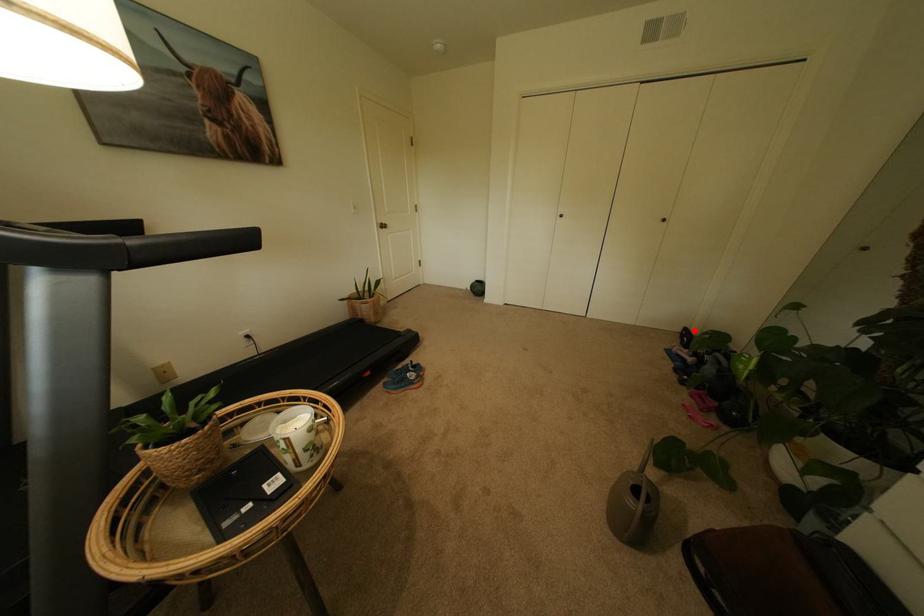
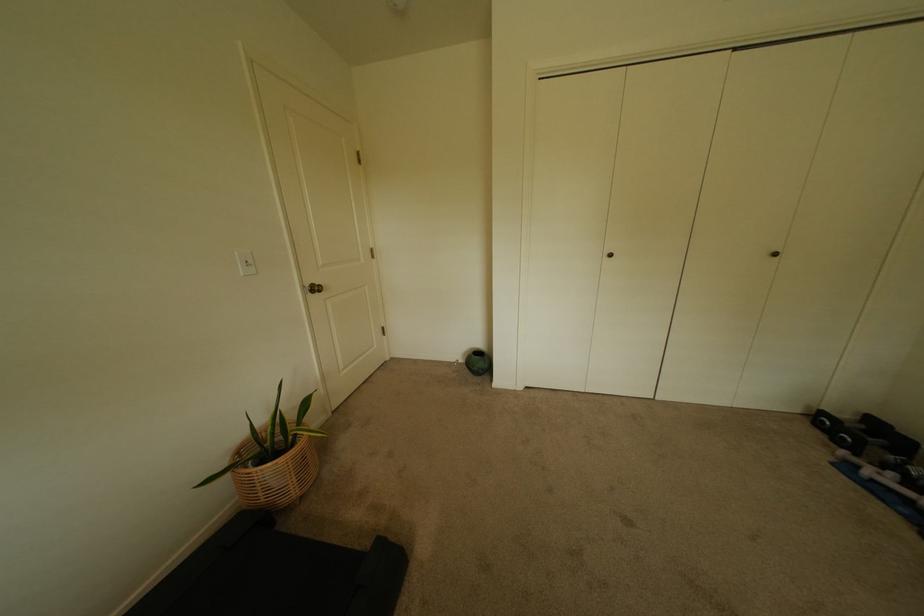
Question: A red point is marked in image1. In image2, is the corresponding 3D point closer to the camera or farther? Reply with the corresponding letter.

Choices:
 (A) The corresponding 3D point is closer.
 (B) The corresponding 3D point is farther.

Answer: (B)